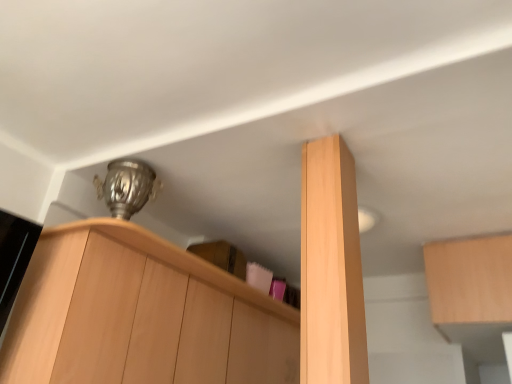
Question: From a real-world perspective, is light wood cabinet at upper right, placed as the 3th cabinetry when sorted from left to right, positioned above or below light wood cabinet at center, acting as the second cabinetry starting from the left?

Choices:
 (A) above
 (B) below

Answer: (A)

Question: Based on their positions, is light wood cabinet at upper right, the first cabinetry positioned from the right, located to the left or right of light wood cabinet at center, acting as the second cabinetry starting from the left?

Choices:
 (A) left
 (B) right

Answer: (B)

Question: Estimate the real-world distances between objects in this image. Which object is closer to the light wood cabinet at center, the second cabinetry when ordered from right to left?

Choices:
 (A) light wood cabinet at upper left, which is the 3th cabinetry in right-to-left order
 (B) light wood cabinet at upper right, placed as the 3th cabinetry when sorted from left to right

Answer: (A)

Question: Estimate the real-world distances between objects in this image. Which object is closer to the light wood cabinet at upper left, the first cabinetry viewed from the left?

Choices:
 (A) light wood cabinet at upper right, the first cabinetry positioned from the right
 (B) light wood cabinet at center, acting as the second cabinetry starting from the left

Answer: (B)